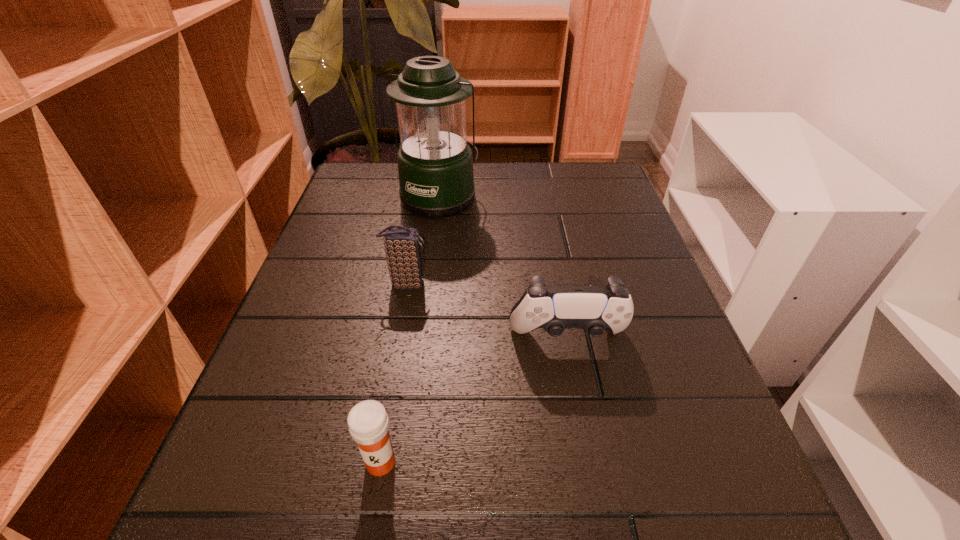
Point out which object is positioned as the nearest to the control. Please provide its 2D coordinates. Your answer should be formatted as a tuple, i.e. [(x, y)], where the tuple contains the x and y coordinates of a point satisfying the conditions above.

[(402, 245)]

Select which object is the third closest to the nearest object. Please provide its 2D coordinates. Your answer should be formatted as a tuple, i.e. [(x, y)], where the tuple contains the x and y coordinates of a point satisfying the conditions above.

[(435, 165)]